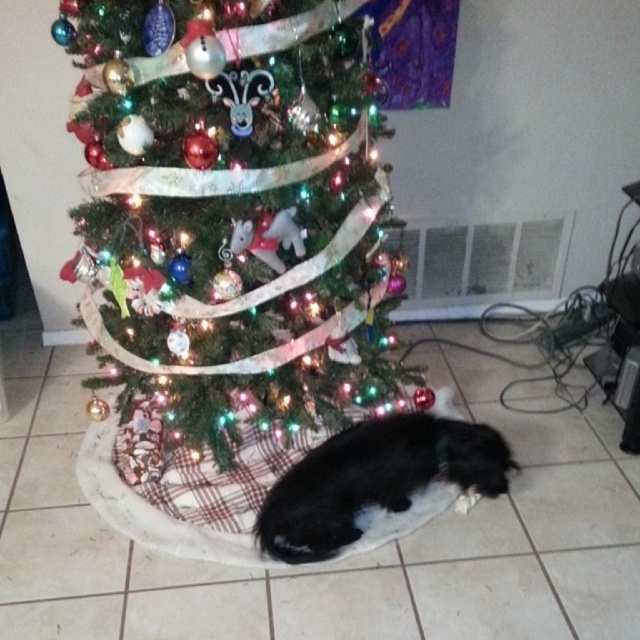
You are a guest at a Christmas party and want to take a photo of the shiny green christmas tree at center and the black fur dog at lower center together in the frame. Can you position yourself so that both are visible without any obstruction?

The shiny green christmas tree at center is in front of the black fur dog at lower center, so the tree will block the view of the dog if you take the photo from the front. To include both in the frame without obstruction, you need to position yourself to the side or behind the dog so that the tree and dog are not overlapping.

From the picture: You are a photographer planning to take a portrait of the black fur dog at lower center and the shiny green christmas tree at center. Since you want the dog to be the main focus, which subject should you position closer to the camera to ensure it appears larger in the photo?

The black fur dog at lower center is smaller than the shiny green christmas tree at center, so to make the dog appear larger in the photo, you should position the black fur dog at lower center closer to the camera.

You are a guest at a Christmas party and you see the shiny green christmas tree at center and the black fur dog at lower center. Which object is located higher in the image?

The shiny green christmas tree at center is located higher than the black fur dog at lower center in the image.